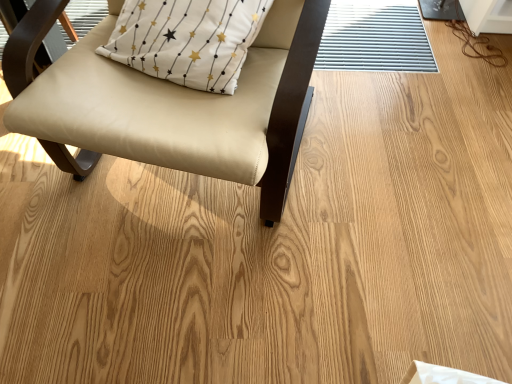
Locate an element on the screen. vacant area that is situated to the right of beige leather chair at upper left is located at coordinates (396, 170).